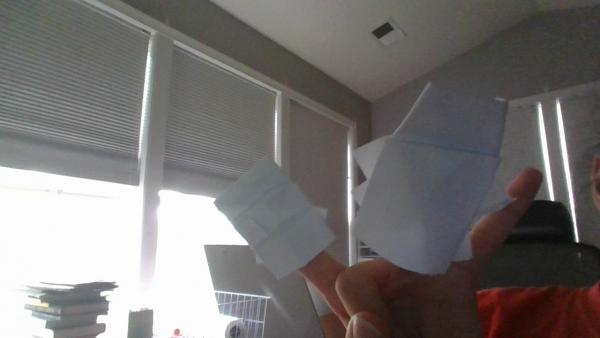
Find the location of a particular element. The width and height of the screenshot is (600, 338). chest is located at coordinates (436, 306).